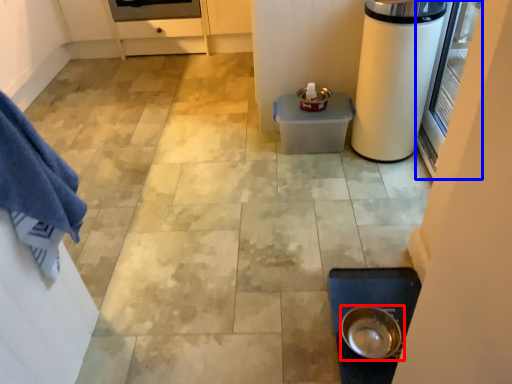
Question: Among these objects, which one is farthest to the camera, kitchen appliance (highlighted by a red box) or screen door (highlighted by a blue box)?

Choices:
 (A) kitchen appliance
 (B) screen door

Answer: (A)